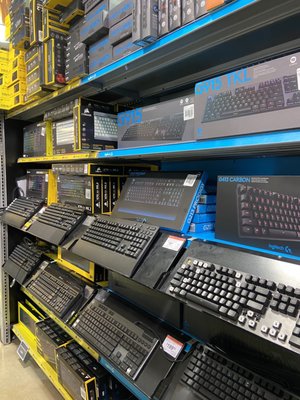
The height and width of the screenshot is (400, 300). Find the location of `blue edge on shelf`. blue edge on shelf is located at coordinates (127, 385).